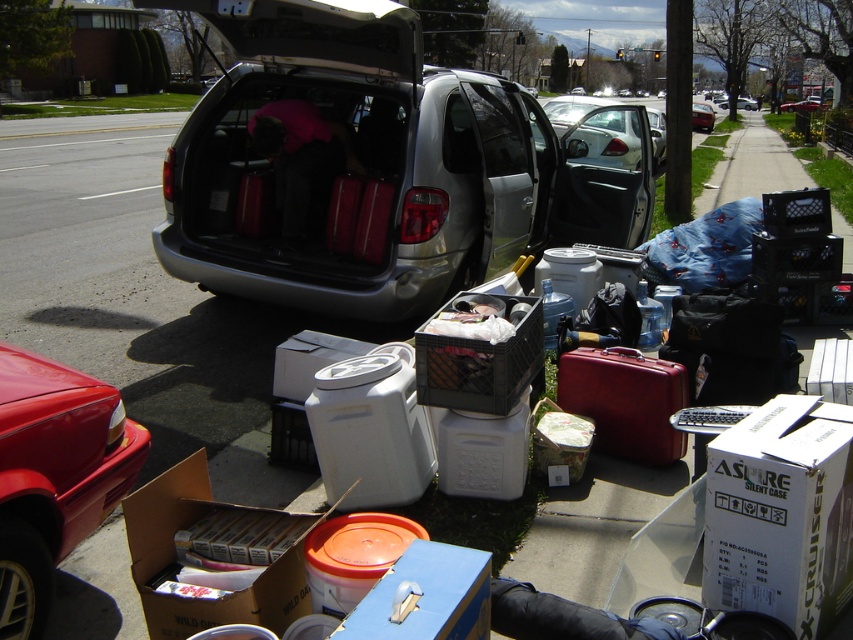
Which is more to the left, silver metallic minivan at center or metallic silver minivan at center?

Positioned to the left is silver metallic minivan at center.

Does silver metallic minivan at center appear over metallic silver minivan at center?

No, silver metallic minivan at center is not above metallic silver minivan at center.

Between point (323, 93) and point (694, 128), which one is positioned behind?

The point (694, 128) is more distant.

Find the location of `silver metallic minivan at center`. silver metallic minivan at center is located at coordinates (370, 168).

Consider the image. Is the position of shiny red car at lower left less distant than that of cardboard box at lower left?

That is True.

Where is `shiny red car at lower left`? shiny red car at lower left is located at coordinates (54, 476).

Does point (16, 602) come in front of point (192, 620)?

That is True.

This screenshot has width=853, height=640. What are the coordinates of `shiny red car at lower left` in the screenshot? It's located at (54, 476).

Is cardboard box at lower left smaller than metallic silver minivan at center?

Correct, cardboard box at lower left occupies less space than metallic silver minivan at center.

Based on the photo, who is shorter, cardboard box at lower left or metallic silver minivan at center?

With less height is cardboard box at lower left.

Where is `cardboard box at lower left`? Image resolution: width=853 pixels, height=640 pixels. cardboard box at lower left is located at coordinates (175, 561).

This screenshot has height=640, width=853. Find the location of `cardboard box at lower left`. cardboard box at lower left is located at coordinates (175, 561).